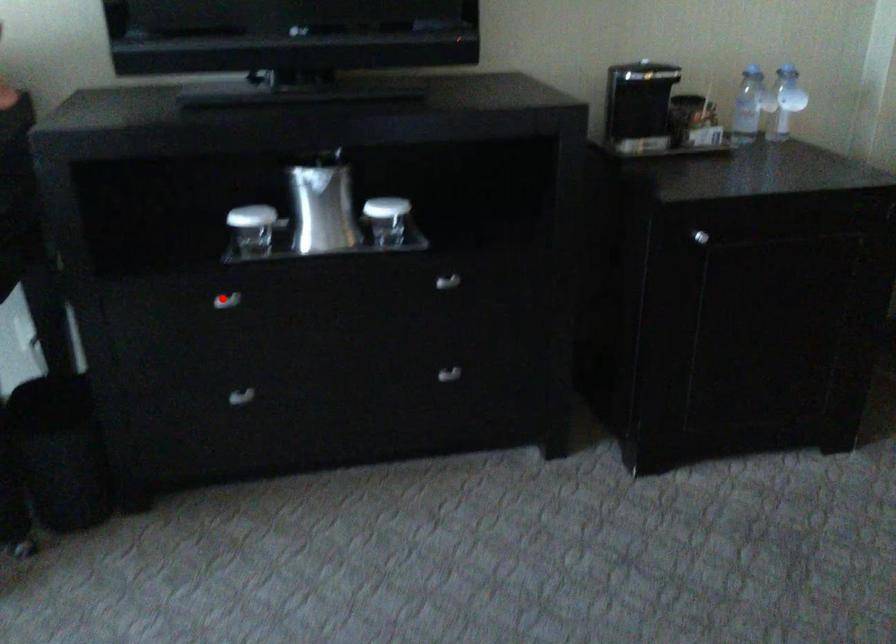
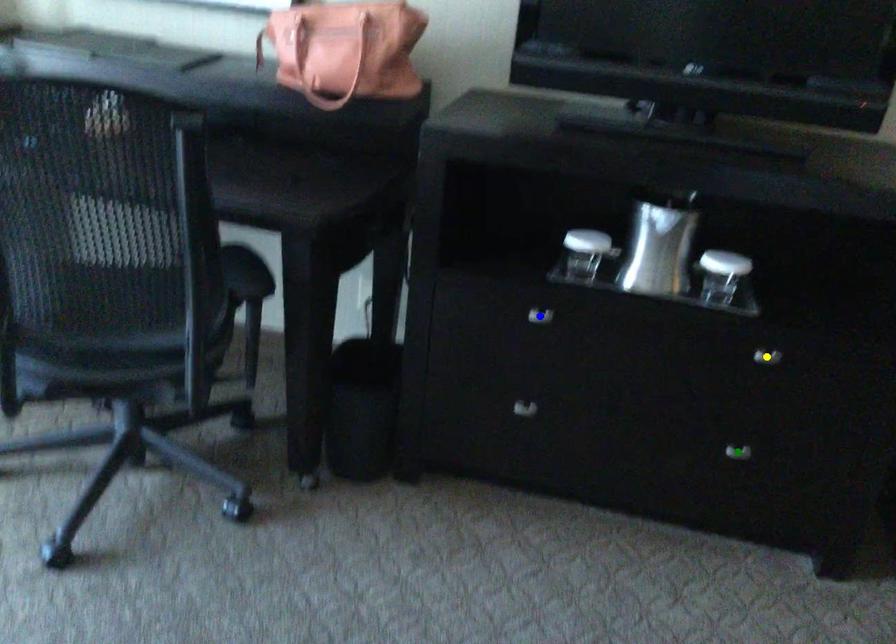
Question: I am providing you with two images of the same scene from different viewpoints. A red point is marked on the first image. You are given multiple points on the second image. Which point in image 2 represents the same 3d spot as the red point in image 1?

Choices:
 (A) blue point
 (B) yellow point
 (C) green point

Answer: (A)